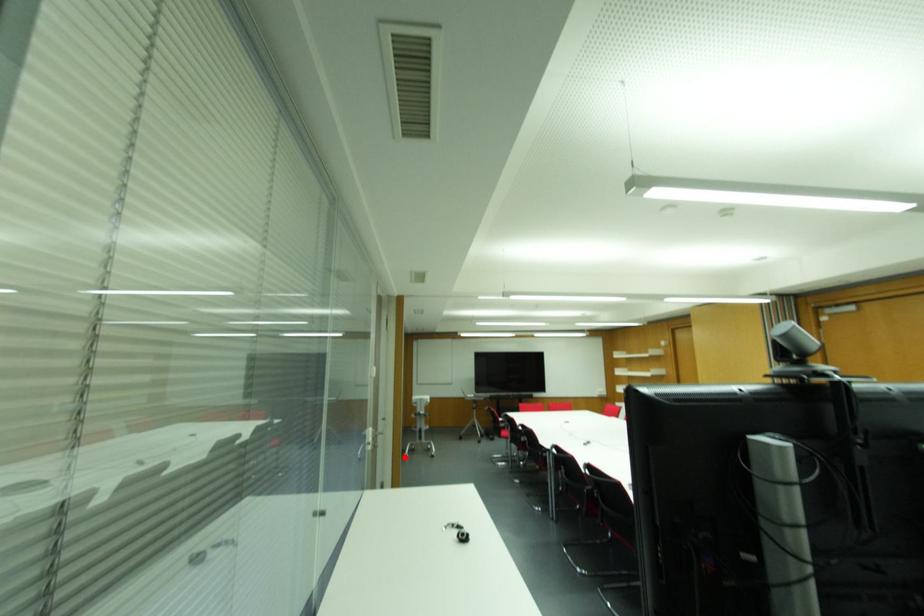
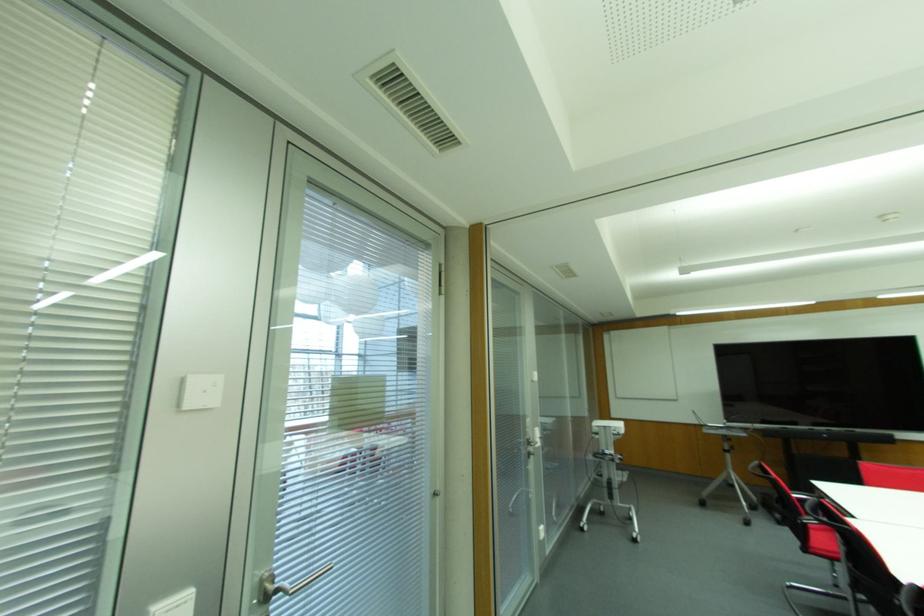
Question: I am providing you with two images of the same scene from different viewpoints. A red point is marked on the first image. Is the red point's position out of view in image 2?

Choices:
 (A) Yes
 (B) No

Answer: (B)